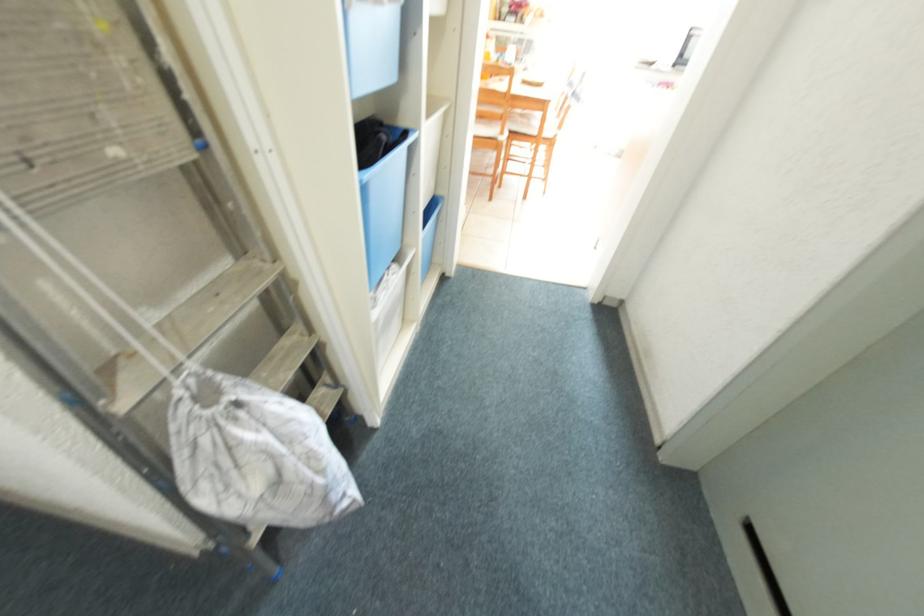
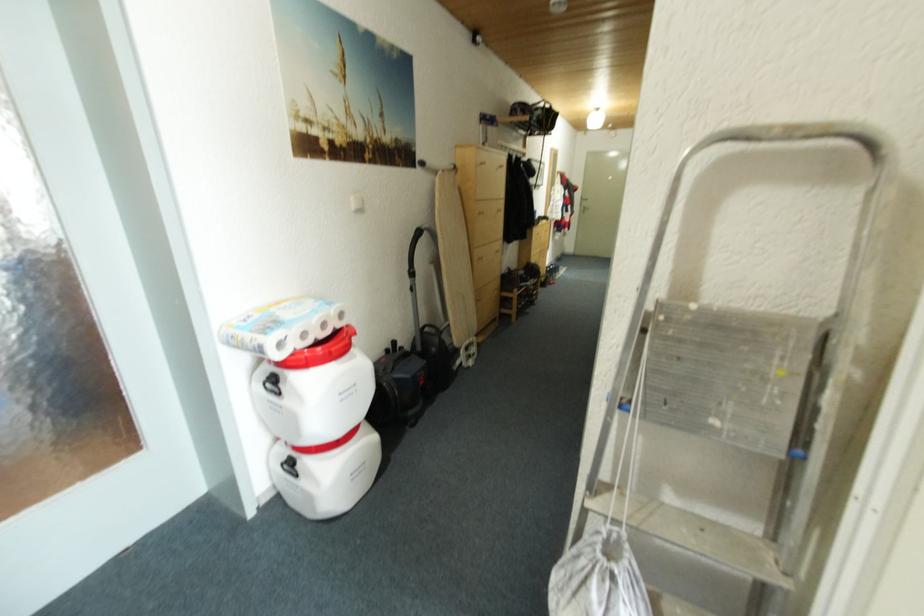
The images are taken continuously from a first-person perspective. In which direction is your viewpoint rotating?

The camera rotated toward left-down.